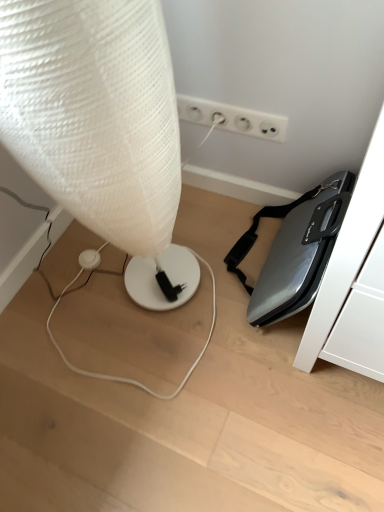
Locate an element on the screen. Image resolution: width=384 pixels, height=512 pixels. free space in front of white textured lamp at left is located at coordinates pyautogui.click(x=150, y=384).